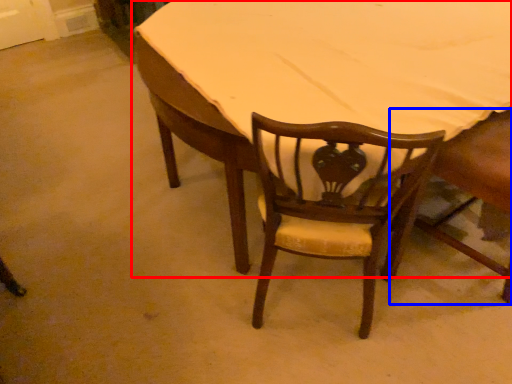
Question: Among these objects, which one is nearest to the camera, table (highlighted by a red box) or chair (highlighted by a blue box)?

Choices:
 (A) table
 (B) chair

Answer: (B)